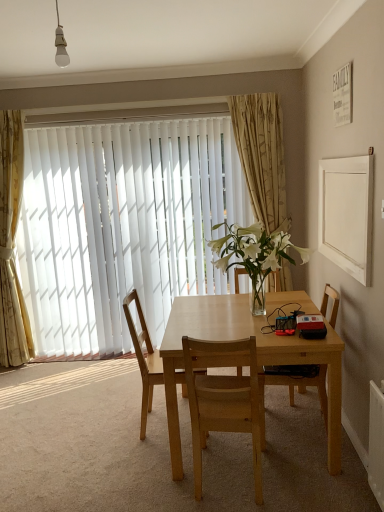
Question: From a real-world perspective, is beige floral fabric curtain at upper center, marked as the first curtain in a right-to-left arrangement, physically located above or below gold textured curtain at left, which is the first curtain in left-to-right order?

Choices:
 (A) below
 (B) above

Answer: (B)

Question: Considering the positions of beige floral fabric curtain at upper center, marked as the first curtain in a right-to-left arrangement, and gold textured curtain at left, the 2th curtain in the right-to-left sequence, in the image, is beige floral fabric curtain at upper center, marked as the first curtain in a right-to-left arrangement, taller or shorter than gold textured curtain at left, the 2th curtain in the right-to-left sequence,?

Choices:
 (A) short
 (B) tall

Answer: (A)

Question: Which of these objects is positioned closest to the light wood chair at center, placed as the 3th chair when sorted from right to left?

Choices:
 (A) light brown wood chair at center, placed as the 2th chair when sorted from right to left
 (B) beige floral fabric curtain at upper center, which is counted as the 2th curtain, starting from the left
 (C) gold textured curtain at left, which is the first curtain in left-to-right order
 (D) white vertical blinds at center
 (E) light wood table at center

Answer: (A)

Question: Which is nearer to the white matte frame at upper right?

Choices:
 (A) light brown wood chair at center, placed as the 2th chair when sorted from right to left
 (B) beige floral fabric curtain at upper center, which is counted as the 2th curtain, starting from the left
 (C) clear glass vase at center
 (D) wooden chair at right, which is the first chair from right to left
 (E) light wood table at center

Answer: (C)